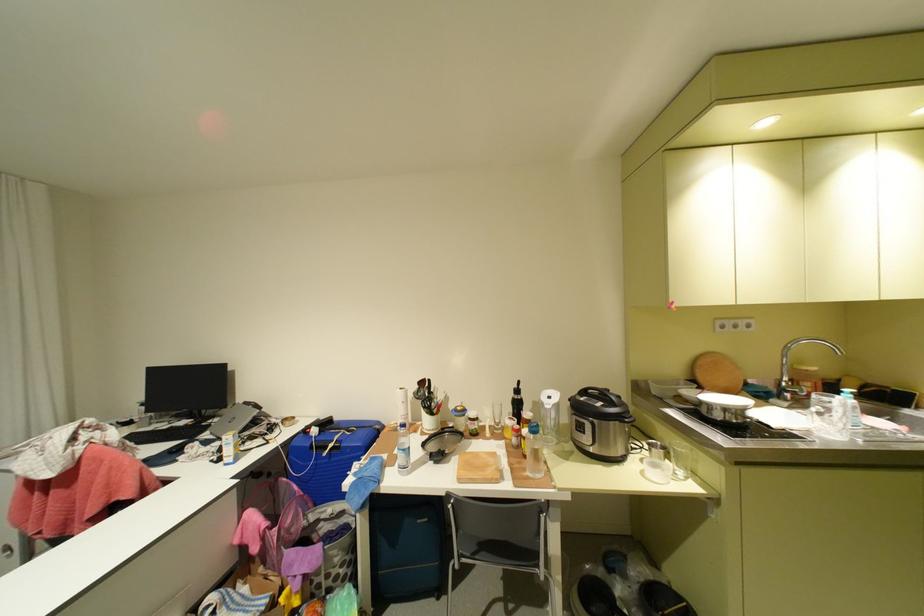
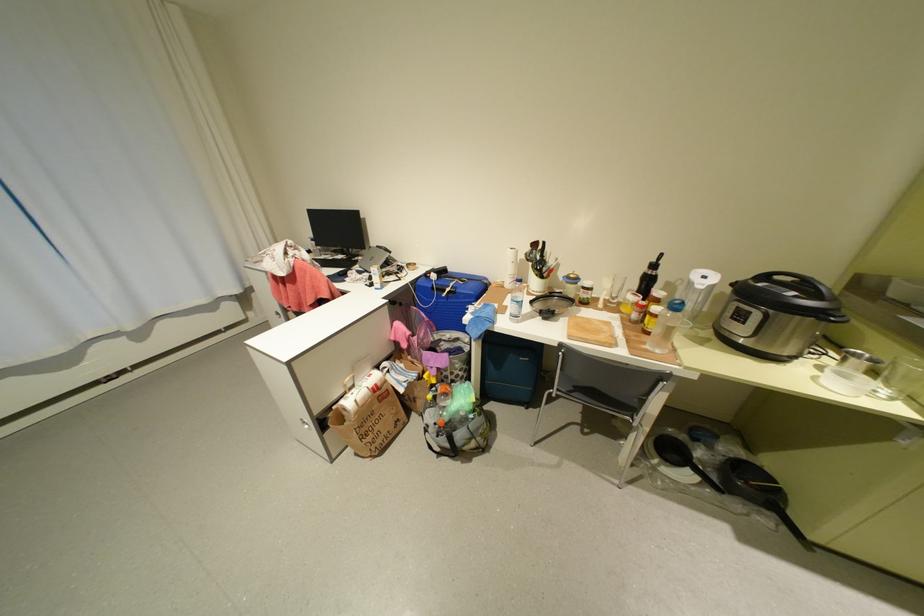
Find the pixel in the second image that matches the point at 597,398 in the first image.

(777, 284)